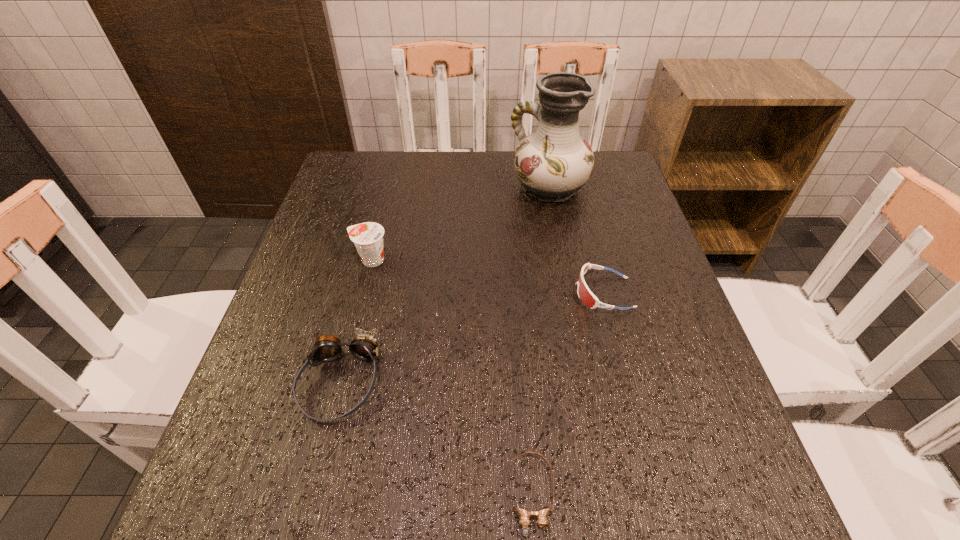
The image size is (960, 540). In order to click on vacant region between the tallest goggles and the nearest goggles in this screenshot , I will do `click(436, 438)`.

This screenshot has width=960, height=540. What are the coordinates of `free space between the fourth tallest object and the leftmost goggles` in the screenshot? It's located at (471, 337).

The image size is (960, 540). In order to click on empty space that is in between the second tallest goggles and the second nearest goggles in this screenshot , I will do `click(471, 337)`.

Where is `empty space between the second tallest goggles and the farthest object`? The height and width of the screenshot is (540, 960). empty space between the second tallest goggles and the farthest object is located at coordinates (576, 240).

Where is `vacant space in between the shortest goggles and the farthest object`? The image size is (960, 540). vacant space in between the shortest goggles and the farthest object is located at coordinates (540, 341).

The width and height of the screenshot is (960, 540). Find the location of `unoccupied area between the second goggles from right to left and the second shortest object`. unoccupied area between the second goggles from right to left and the second shortest object is located at coordinates (567, 394).

Locate an element on the screen. Image resolution: width=960 pixels, height=540 pixels. empty space between the leftmost goggles and the vase is located at coordinates (444, 285).

This screenshot has width=960, height=540. Identify the location of vacant region between the shortest goggles and the second nearest goggles. (436, 438).

Where is `unoccupied area between the farthest goggles and the second farthest goggles`? unoccupied area between the farthest goggles and the second farthest goggles is located at coordinates (471, 337).

Where is `unoccupied position between the farthest object and the third shortest object`? The image size is (960, 540). unoccupied position between the farthest object and the third shortest object is located at coordinates (444, 285).